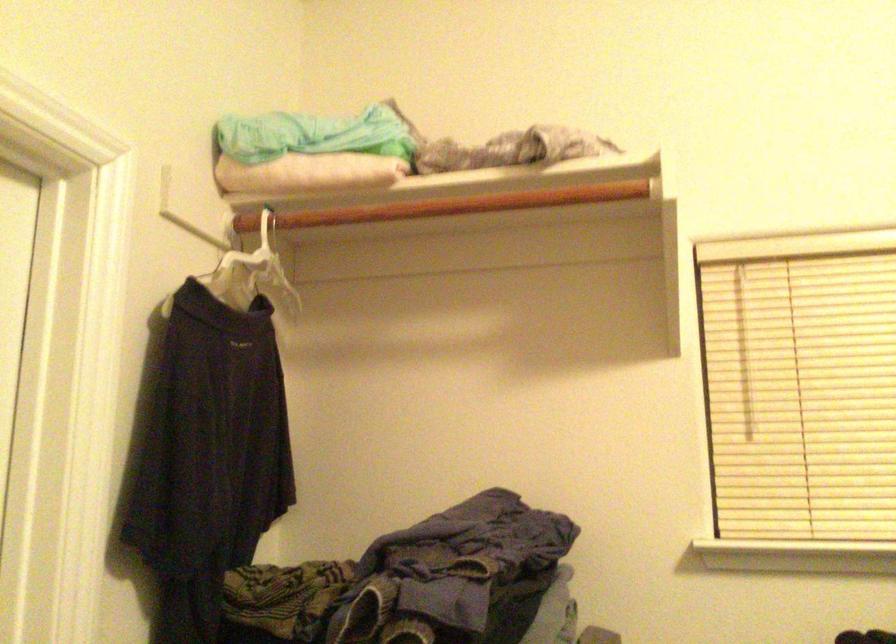
Where is `wooden clothing rod`? The height and width of the screenshot is (644, 896). wooden clothing rod is located at coordinates (452, 205).